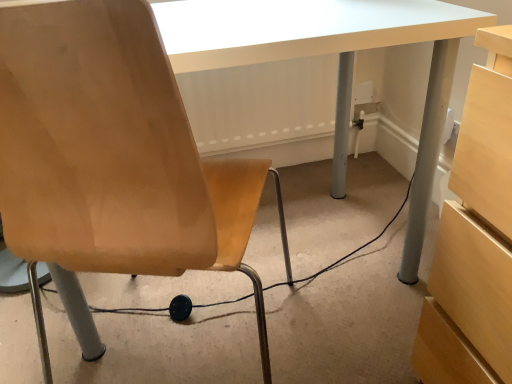
The image size is (512, 384). Identify the location of black rubber cable at lower center. (170, 307).

What do you see at coordinates (170, 307) in the screenshot?
I see `black rubber cable at lower center` at bounding box center [170, 307].

This screenshot has height=384, width=512. Describe the element at coordinates (111, 154) in the screenshot. I see `matte wood chair at left` at that location.

In order to face matte wood chair at left, should I rotate leftwards or rightwards?

A 13.787 degree turn to the left will do.

The image size is (512, 384). I want to click on matte wood chair at left, so click(111, 154).

Identify the location of black rubber cable at lower center. (170, 307).

Is matte wood chair at left to the left or to the right of black rubber cable at lower center in the image?

In the image, matte wood chair at left appears on the left side of black rubber cable at lower center.

Considering the positions of objects matte wood chair at left and black rubber cable at lower center in the image provided, who is in front, matte wood chair at left or black rubber cable at lower center?

matte wood chair at left is in front.

Considering the positions of point (202, 185) and point (180, 317), is point (202, 185) closer or farther from the camera than point (180, 317)?

Point (202, 185) appears to be closer to the viewer than point (180, 317).

From the image's perspective, between matte wood chair at left and black rubber cable at lower center, who is located below?

black rubber cable at lower center is shown below in the image.

From a real-world perspective, which object rests below the other?

From a 3D spatial view, black rubber cable at lower center is below.

Is matte wood chair at left wider than black rubber cable at lower center?

In fact, matte wood chair at left might be narrower than black rubber cable at lower center.

Looking at this image, which of these two, matte wood chair at left or black rubber cable at lower center, stands shorter?

black rubber cable at lower center.

Considering the sizes of matte wood chair at left and black rubber cable at lower center in the image, is matte wood chair at left bigger or smaller than black rubber cable at lower center?

matte wood chair at left is bigger than black rubber cable at lower center.

Is matte wood chair at left spatially inside black rubber cable at lower center, or outside of it?

matte wood chair at left is spatially situated outside black rubber cable at lower center.

Consider the image. Is matte wood chair at left far from black rubber cable at lower center?

No, matte wood chair at left is in close proximity to black rubber cable at lower center.

Is matte wood chair at left facing towards black rubber cable at lower center?

No, matte wood chair at left is not facing towards black rubber cable at lower center.

Measure the distance between matte wood chair at left and black rubber cable at lower center.

A distance of 23.90 inches exists between matte wood chair at left and black rubber cable at lower center.

I want to click on chair lying on the left of black rubber cable at lower center, so click(x=111, y=154).

Considering the positions of objects black rubber cable at lower center and matte wood chair at left in the image provided, who is more to the left, black rubber cable at lower center or matte wood chair at left?

From the viewer's perspective, matte wood chair at left appears more on the left side.

Based on the photo, relative to matte wood chair at left, is black rubber cable at lower center in front or behind?

In the image, black rubber cable at lower center appears behind matte wood chair at left.

Considering the points (403, 207) and (32, 254), which point is in front, point (403, 207) or point (32, 254)?

Point (32, 254)

From the image's perspective, is black rubber cable at lower center positioned above or below matte wood chair at left?

From the image's perspective, black rubber cable at lower center appears below matte wood chair at left.

From a real-world perspective, is black rubber cable at lower center below matte wood chair at left?

Yes, from a real-world perspective, black rubber cable at lower center is beneath matte wood chair at left.

Between black rubber cable at lower center and matte wood chair at left, which one has smaller width?

matte wood chair at left.

Who is taller, black rubber cable at lower center or matte wood chair at left?

With more height is matte wood chair at left.

Looking at this image, considering the relative sizes of black rubber cable at lower center and matte wood chair at left in the image provided, is black rubber cable at lower center smaller than matte wood chair at left?

Correct, black rubber cable at lower center occupies less space than matte wood chair at left.

Is black rubber cable at lower center situated inside matte wood chair at left or outside?

black rubber cable at lower center is not enclosed by matte wood chair at left.

Looking at this image, are black rubber cable at lower center and matte wood chair at left beside each other?

There is a gap between black rubber cable at lower center and matte wood chair at left.

Could you tell me if black rubber cable at lower center is facing matte wood chair at left?

No, black rubber cable at lower center is not facing towards matte wood chair at left.

I want to click on chair positioned vertically above the black rubber cable at lower center (from a real-world perspective), so click(x=111, y=154).

Identify the location of cable behind the matte wood chair at left. (170, 307).

Locate an element on the screen. Image resolution: width=512 pixels, height=384 pixels. cable that appears on the right of matte wood chair at left is located at coordinates (170, 307).